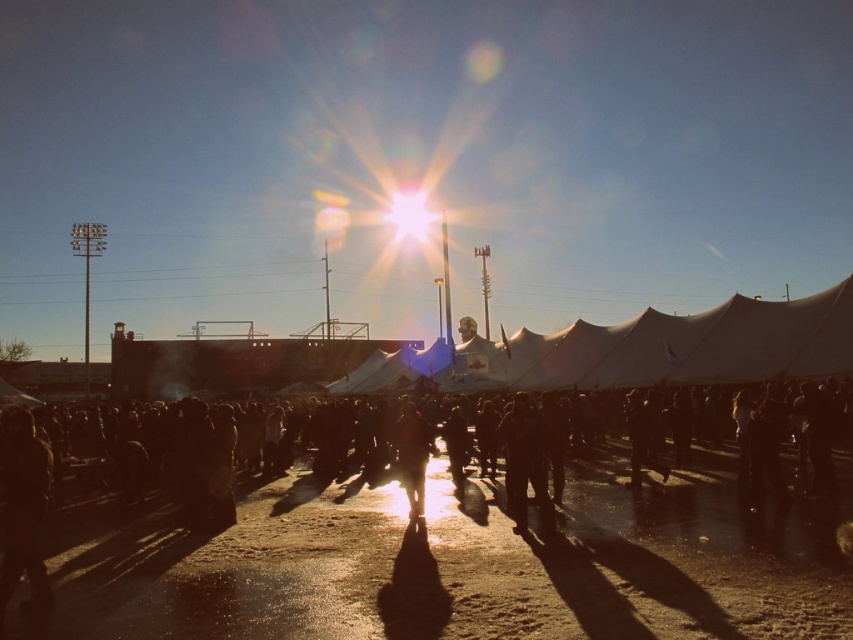
Question: Which object appears closest to the camera in this image?

Choices:
 (A) silhouette figure at center
 (B) dark fabric pants at center

Answer: (B)

Question: Is dark fabric pants at center behind silhouette figure at center?

Choices:
 (A) no
 (B) yes

Answer: (A)

Question: Which point is closer to the camera?

Choices:
 (A) (526, 417)
 (B) (38, 444)

Answer: (B)

Question: Is dark fabric jacket at left positioned before silhouette figure at center?

Choices:
 (A) yes
 (B) no

Answer: (A)

Question: Does dark fabric jacket at left appear over silhouette figure at center?

Choices:
 (A) no
 (B) yes

Answer: (B)

Question: Which of the following is the closest to the observer?

Choices:
 (A) silhouette figure at center
 (B) dark fabric pants at center
 (C) dark fabric jacket at left

Answer: (C)